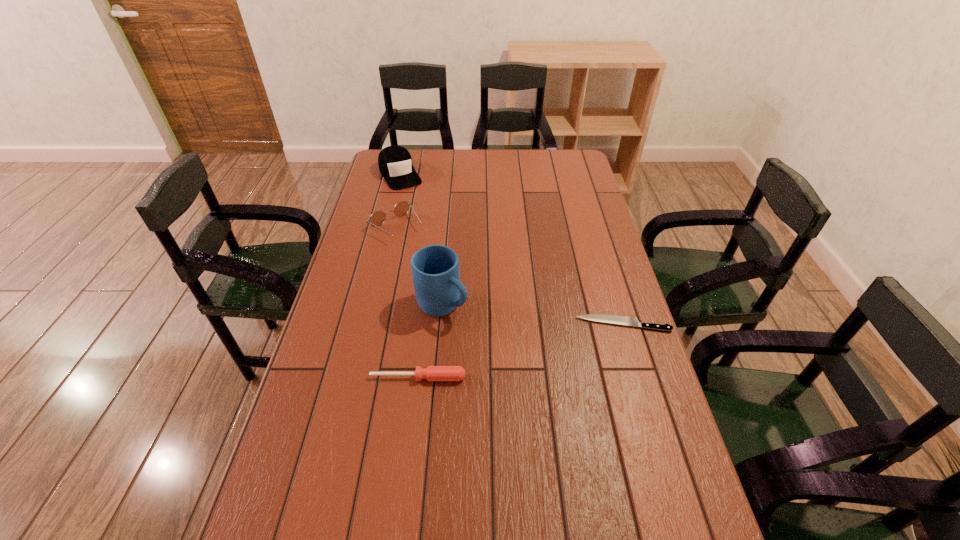
Image resolution: width=960 pixels, height=540 pixels. In order to click on vacant space on the desktop that is between the nearest object and the rightmost object and is positioned on the front-facing side of the second tallest object in this screenshot , I will do `click(514, 353)`.

You are a GUI agent. You are given a task and a screenshot of the screen. Output one action in this format:
    pyautogui.click(x=<x>, y=<y>)
    Task: Click on the free space on the desktop that is between the nearest object and the steak knife and is positioned on the front-facing side of the fourth nearest object
    This screenshot has height=540, width=960.
    Given the screenshot: What is the action you would take?
    pyautogui.click(x=525, y=349)

Identify the location of vacant space on the desktop that is between the screwdriver and the rightmost object and is positioned on the side of the tallest object with the handle. (507, 354).